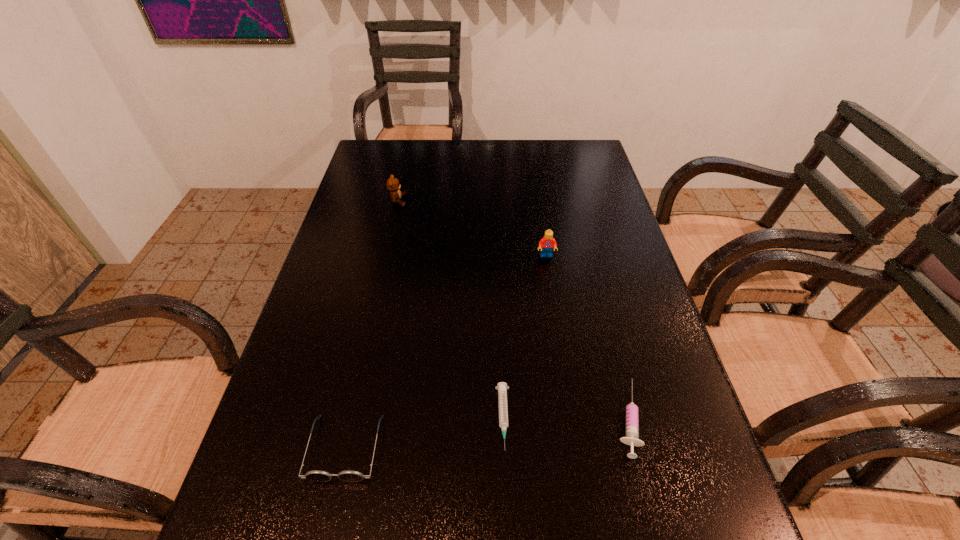
The width and height of the screenshot is (960, 540). Identify the location of the farthest object. (393, 186).

The image size is (960, 540). Identify the location of the second farthest object. (547, 243).

Where is `Lego`? This screenshot has height=540, width=960. Lego is located at coordinates (547, 243).

The image size is (960, 540). Identify the location of sunglasses. (316, 475).

Where is `the rightmost object`? This screenshot has height=540, width=960. the rightmost object is located at coordinates 632,411.

You are a GUI agent. You are given a task and a screenshot of the screen. Output one action in this format:
    pyautogui.click(x=<x>, y=<y>)
    Task: Click on the taller syringe
    This screenshot has width=960, height=540.
    Given the screenshot: What is the action you would take?
    pyautogui.click(x=632, y=411)

Identify the location of the shorter syringe. (502, 387).

The image size is (960, 540). In order to click on the third object from right to left in this screenshot , I will do `click(502, 387)`.

Where is `vacant space located 0.380m on the front-facing side of the farthest object`? vacant space located 0.380m on the front-facing side of the farthest object is located at coordinates (528, 201).

Find the location of a particular element. The height and width of the screenshot is (540, 960). vacant space located on the face of the Lego is located at coordinates (562, 355).